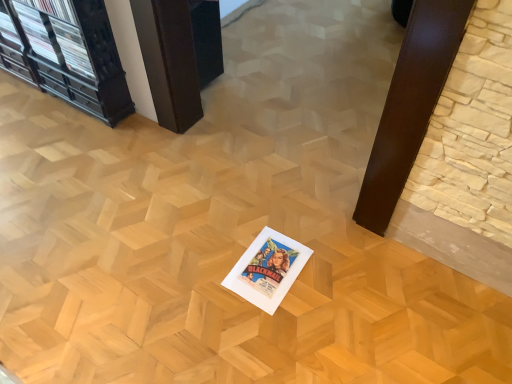
At what (x,y) coordinates should I click in order to perform the action: click on free point in front of white paper at center. Please return your answer as a coordinate pair (x, y). Image resolution: width=512 pixels, height=384 pixels. Looking at the image, I should click on (270, 331).